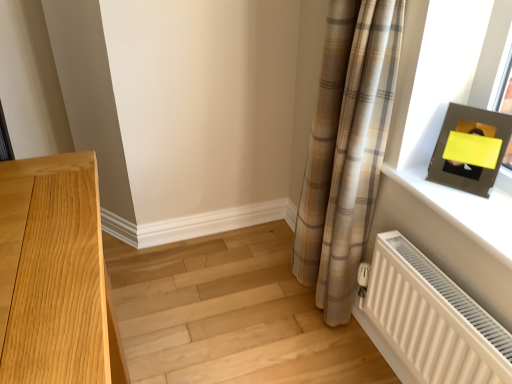
Find the location of a particular element. Image resolution: width=512 pixels, height=384 pixels. free location in front of plaid fabric curtain at right is located at coordinates (305, 352).